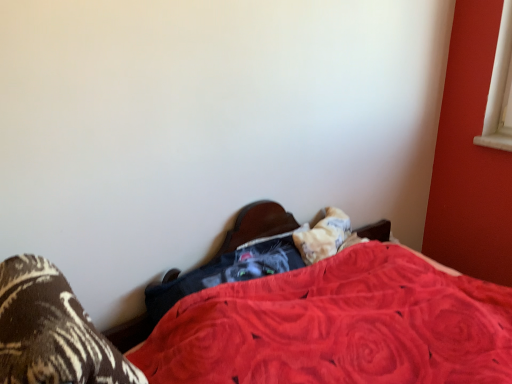
Measure the distance between point (401, 306) and camera.

Point (401, 306) and camera are 4.74 feet apart from each other.

In order to face velvet red blanket at center, should I rotate leftwards or rightwards?

It's best to rotate right around 13.465 degrees.

The height and width of the screenshot is (384, 512). What are the coordinates of `brown textured socks at lower left` in the screenshot? It's located at (52, 331).

Can we say velvet-like black cat at center lies outside velvet red blanket at center?

No, velvet-like black cat at center is not outside of velvet red blanket at center.

Is velvet-like black cat at center next to velvet red blanket at center and touching it?

velvet-like black cat at center and velvet red blanket at center are not in contact.

Is velvet-like black cat at center oriented away from velvet red blanket at center?

Yes, velvet-like black cat at center is positioned with its back facing velvet red blanket at center.

From the picture: Is velvet-like black cat at center to the right of velvet red blanket at center from the viewer's perspective?

Incorrect, velvet-like black cat at center is not on the right side of velvet red blanket at center.

From the image's perspective, relative to fluffy white pillow at lower center, is velvet red blanket at center above or below?

velvet red blanket at center is below fluffy white pillow at lower center.

Based on the photo, is velvet red blanket at center outside of fluffy white pillow at lower center?

Absolutely, velvet red blanket at center is external to fluffy white pillow at lower center.

From a real-world perspective, is velvet red blanket at center positioned over fluffy white pillow at lower center based on gravity?

No, from a real-world perspective, velvet red blanket at center is not over fluffy white pillow at lower center

From a real-world perspective, is velvet red blanket at center on velvet-like black cat at center?

No.

Measure the distance between velvet red blanket at center and velvet-like black cat at center.

They are 8.34 inches apart.

The width and height of the screenshot is (512, 384). Identify the location of clothing lying behind the velvet red blanket at center. (225, 273).

From the image's perspective, which one is positioned higher, brown textured socks at lower left or fluffy white pillow at lower center?

fluffy white pillow at lower center, from the image's perspective.

Is brown textured socks at lower left turned away from fluffy white pillow at lower center?

No, brown textured socks at lower left is not facing away from fluffy white pillow at lower center.

Who is smaller, brown textured socks at lower left or fluffy white pillow at lower center?

Smaller between the two is fluffy white pillow at lower center.

Is brown textured socks at lower left thinner than fluffy white pillow at lower center?

No.

Is velvet red blanket at center inside the boundaries of brown textured socks at lower left, or outside?

velvet red blanket at center is outside brown textured socks at lower left.

Which of these two, velvet red blanket at center or brown textured socks at lower left, is wider?

velvet red blanket at center is wider.

Based on the photo, is velvet red blanket at center at the left side of brown textured socks at lower left?

Incorrect, velvet red blanket at center is not on the left side of brown textured socks at lower left.

Which point is more distant from viewer, [228,259] or [336,237]?

The point [336,237] is farther from the camera.

From the image's perspective, is velvet-like black cat at center below fluffy white pillow at lower center?

Correct, velvet-like black cat at center appears lower than fluffy white pillow at lower center in the image.

Could fluffy white pillow at lower center be considered to be inside velvet-like black cat at center?

No, fluffy white pillow at lower center is not inside velvet-like black cat at center.

Is velvet-like black cat at center bigger or smaller than fluffy white pillow at lower center?

velvet-like black cat at center is bigger than fluffy white pillow at lower center.

In the scene shown: Is velvet-like black cat at center behind brown textured socks at lower left?

Yes.

Is velvet-like black cat at center not close to brown textured socks at lower left?

No.

Can you confirm if velvet-like black cat at center is bigger than brown textured socks at lower left?

No.

Is velvet-like black cat at center wider or thinner than brown textured socks at lower left?

Clearly, velvet-like black cat at center has less width compared to brown textured socks at lower left.

Where is `clothing above the velvet red blanket at center (from the image's perspective)`? This screenshot has height=384, width=512. clothing above the velvet red blanket at center (from the image's perspective) is located at coordinates (225, 273).

Find the location of a particular element. pillow above the velvet red blanket at center (from a real-world perspective) is located at coordinates tap(323, 236).

Based on their spatial positions, is velvet-like black cat at center or brown textured socks at lower left closer to velvet red blanket at center?

velvet-like black cat at center lies closer to velvet red blanket at center than the other object.

When comparing their distances from velvet-like black cat at center, does brown textured socks at lower left or velvet red blanket at center seem closer?

The object closer to velvet-like black cat at center is velvet red blanket at center.

In the scene shown: Estimate the real-world distances between objects in this image. Which object is closer to fluffy white pillow at lower center, velvet red blanket at center or brown textured socks at lower left?

Among the two, velvet red blanket at center is located nearer to fluffy white pillow at lower center.

Based on their spatial positions, is velvet-like black cat at center or velvet red blanket at center further from brown textured socks at lower left?

velvet-like black cat at center.

In the scene shown: Looking at the image, which one is located further to velvet red blanket at center, fluffy white pillow at lower center or brown textured socks at lower left?

Based on the image, brown textured socks at lower left appears to be further to velvet red blanket at center.

Which object lies nearer to the anchor point fluffy white pillow at lower center, velvet red blanket at center or velvet-like black cat at center?

velvet-like black cat at center.

Based on their spatial positions, is velvet-like black cat at center or fluffy white pillow at lower center closer to brown textured socks at lower left?

velvet-like black cat at center lies closer to brown textured socks at lower left than the other object.

Based on the photo, based on their spatial positions, is velvet-like black cat at center or velvet red blanket at center closer to fluffy white pillow at lower center?

The object closer to fluffy white pillow at lower center is velvet-like black cat at center.

You are a GUI agent. You are given a task and a screenshot of the screen. Output one action in this format:
    pyautogui.click(x=<x>, y=<y>)
    Task: Click on the clothing located between brown textured socks at lower left and fluffy white pillow at lower center in the depth direction
    This screenshot has width=512, height=384.
    Given the screenshot: What is the action you would take?
    pyautogui.click(x=225, y=273)

Find the location of `footwear positioned between velvet red blanket at center and fluffy white pillow at lower center from near to far`. footwear positioned between velvet red blanket at center and fluffy white pillow at lower center from near to far is located at coordinates (52, 331).

I want to click on footwear between velvet red blanket at center and velvet-like black cat at center along the z-axis, so click(x=52, y=331).

The width and height of the screenshot is (512, 384). In order to click on clothing between velvet red blanket at center and fluffy white pillow at lower center in the front-back direction in this screenshot , I will do [225, 273].